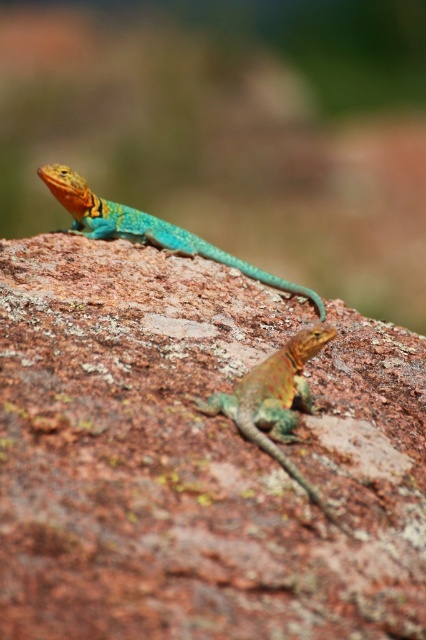
You are a photographer trying to capture both lizards in your shot. You notice two points marked on your screen at coordinates point (193,392) and point (299,390). Which point is closer to the camera?

Point (193,392) is in front of point (299,390), so the point closer to the camera is point (193,392).

You are a photographer trying to capture both the rusty rock at center and the shiny turquoise lizard at upper center in a single frame. Based on their positions, which object should you adjust your camera focus to first to ensure both are in the frame?

Since the rusty rock at center is to the right of the shiny turquoise lizard at upper center, you should first focus on the shiny turquoise lizard at upper center to ensure both fit within the frame.

You are a photographer trying to capture both the rusty rock at center and the shiny turquoise lizard at upper center in a single shot. Based on their positions, which object will appear larger in your photo?

The rusty rock at center will appear larger in the photo because it is closer to the viewer than the shiny turquoise lizard at upper center.